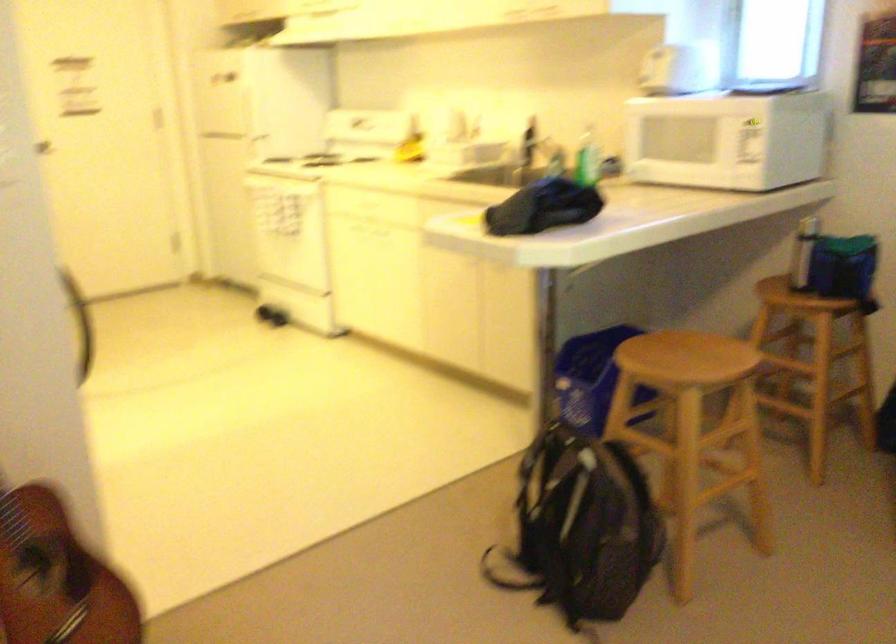
The location [591,377] corresponds to which object?

It corresponds to the small blue bag in the image.